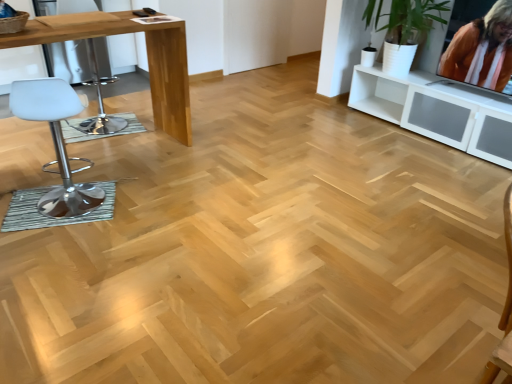
Find the location of a particular element. vacant point to the right of light brown glossy table at left is located at coordinates (221, 172).